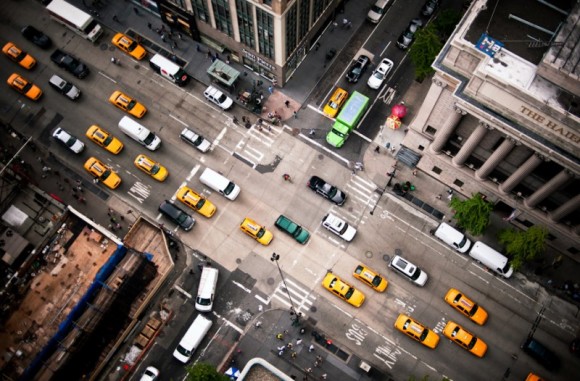
I want to click on columns, so pos(444,126), pos(466,142), pos(490,154), pos(528,166), pos(549,182), pos(566,208).